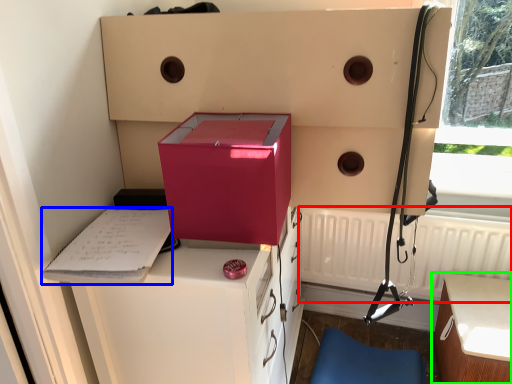
Question: Which object is positioned farthest from radiator (highlighted by a red box)? Select from clipboard (highlighted by a blue box) and table (highlighted by a green box).

Choices:
 (A) clipboard
 (B) table

Answer: (A)